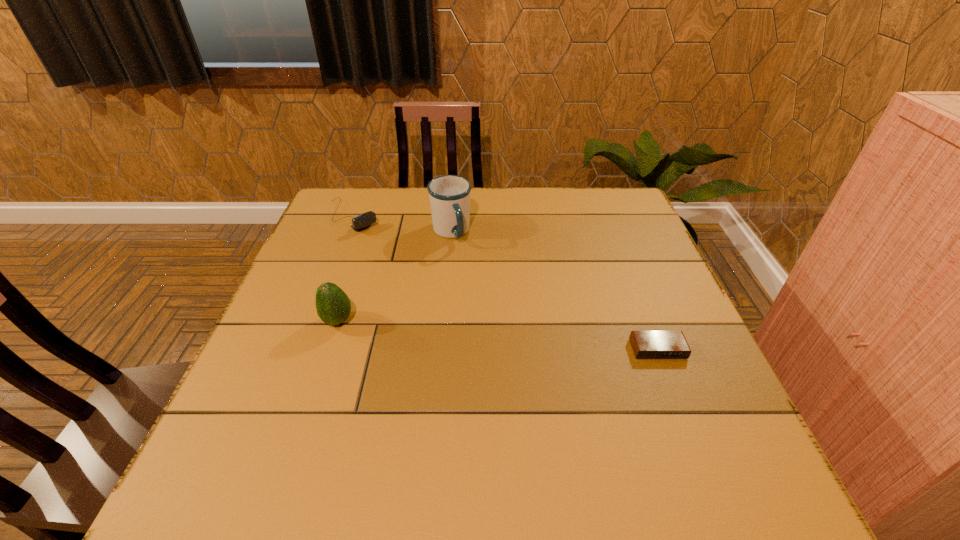
The image size is (960, 540). Identify the location of empty space between the nearest object and the third shortest object. (498, 335).

Locate an element on the screen. This screenshot has width=960, height=540. vacant area that lies between the second nearest object and the second object from right to left is located at coordinates (395, 277).

Where is `vacant area that lies between the shortest object and the third farthest object`? vacant area that lies between the shortest object and the third farthest object is located at coordinates (498, 335).

Where is `empty space between the tallest object and the third farthest object`? empty space between the tallest object and the third farthest object is located at coordinates (395, 277).

The image size is (960, 540). Find the location of `vacant region between the rightmost object and the second shortest object`. vacant region between the rightmost object and the second shortest object is located at coordinates (505, 283).

Locate an element on the screen. unoccupied area between the avocado and the nearest object is located at coordinates (498, 335).

Where is `unoccupied position between the rightmost object and the mug`? This screenshot has width=960, height=540. unoccupied position between the rightmost object and the mug is located at coordinates click(554, 291).

Select which object appears as the third closest to the webcam. Please provide its 2D coordinates. Your answer should be formatted as a tuple, i.e. [(x, y)], where the tuple contains the x and y coordinates of a point satisfying the conditions above.

[(646, 344)]

I want to click on the second closest object to the nearest object, so click(x=333, y=306).

At what (x,y) coordinates should I click in order to perform the action: click on vacant area that satisfies the following two spatial constraints: 1. on the back side of the tallest object; 2. on the left side of the third farthest object. Please return your answer as a coordinate pair (x, y). This screenshot has height=540, width=960. Looking at the image, I should click on 368,233.